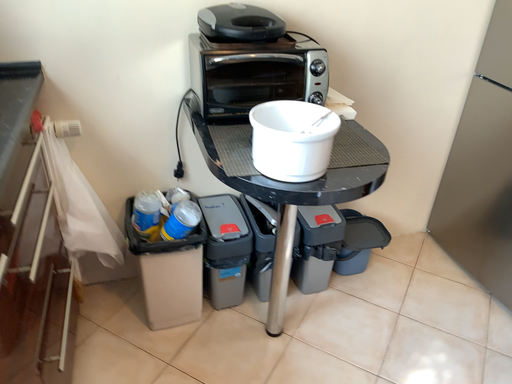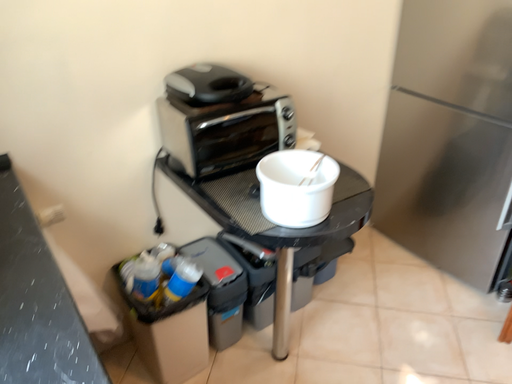
Question: Which way did the camera rotate in the video?

Choices:
 (A) rotated left
 (B) rotated right

Answer: (B)